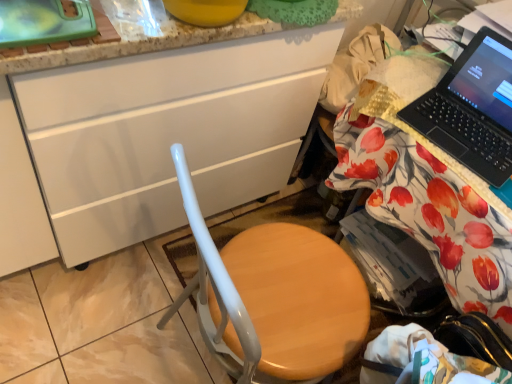
Question: Is wooden desk at right wider or thinner than wooden seat at center?

Choices:
 (A) wide
 (B) thin

Answer: (A)

Question: Does point (348, 99) appear closer or farther from the camera than point (210, 340)?

Choices:
 (A) farther
 (B) closer

Answer: (A)

Question: Which object is positioned closest to the wooden seat at center?

Choices:
 (A) wooden desk at right
 (B) black plastic laptop at upper right
 (C) white glossy cabinet at center

Answer: (A)

Question: Based on their relative distances, which object is farther from the black plastic laptop at upper right?

Choices:
 (A) white glossy cabinet at center
 (B) wooden seat at center
 (C) wooden desk at right

Answer: (A)